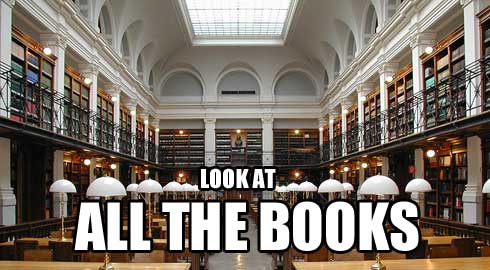
Locate an element on the screen. white columns at back wall is located at coordinates (210, 137), (269, 137).